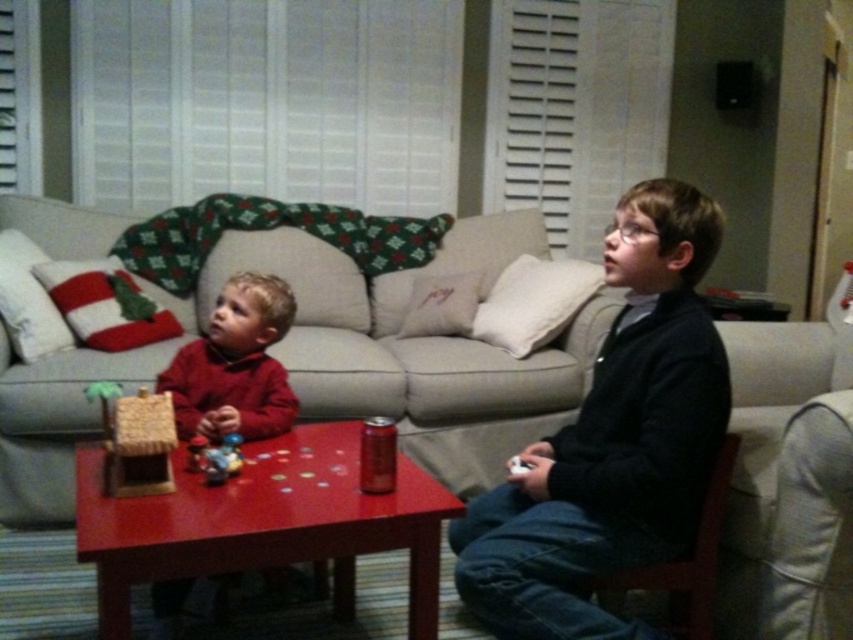
In the scene shown: Which is more to the right, smooth wooden table at center or matte red sweater at left?

smooth wooden table at center

Does smooth wooden table at center lie in front of matte red sweater at left?

Yes, smooth wooden table at center is closer to the viewer.

Does point (358, 529) come in front of point (228, 422)?

Yes, it is in front of point (228, 422).

Locate an element on the screen. This screenshot has height=640, width=853. smooth wooden table at center is located at coordinates (264, 522).

Image resolution: width=853 pixels, height=640 pixels. What are the coordinates of `matte red sweater at left` in the screenshot? It's located at (235, 364).

This screenshot has height=640, width=853. Describe the element at coordinates (235, 364) in the screenshot. I see `matte red sweater at left` at that location.

Does point (260, 369) come behind point (709, 620)?

Yes, it is.

The width and height of the screenshot is (853, 640). In order to click on matte red sweater at left in this screenshot , I will do `click(235, 364)`.

Between point (90, 509) and point (663, 582), which one is positioned in front?

Point (90, 509) is in front.

This screenshot has width=853, height=640. I want to click on smooth wooden table at center, so (264, 522).